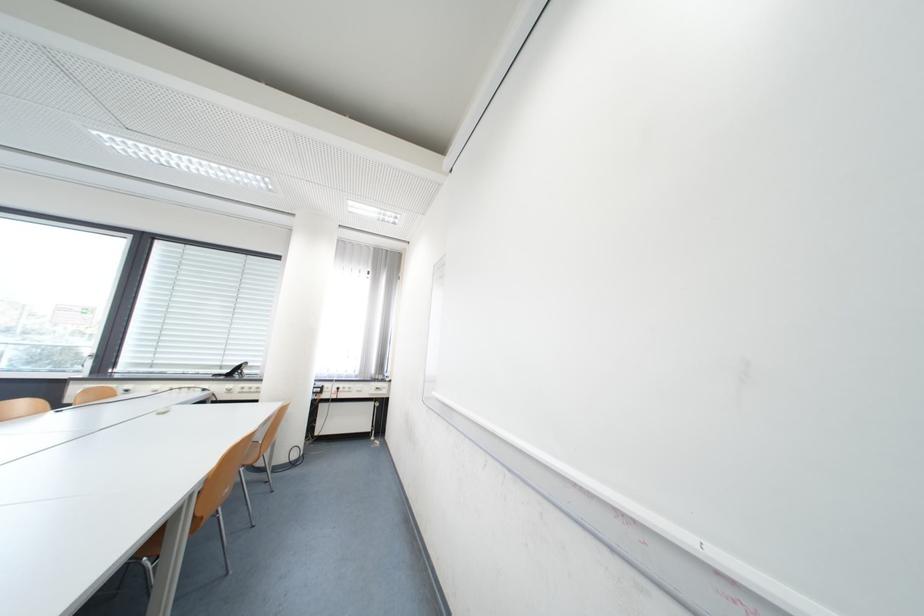
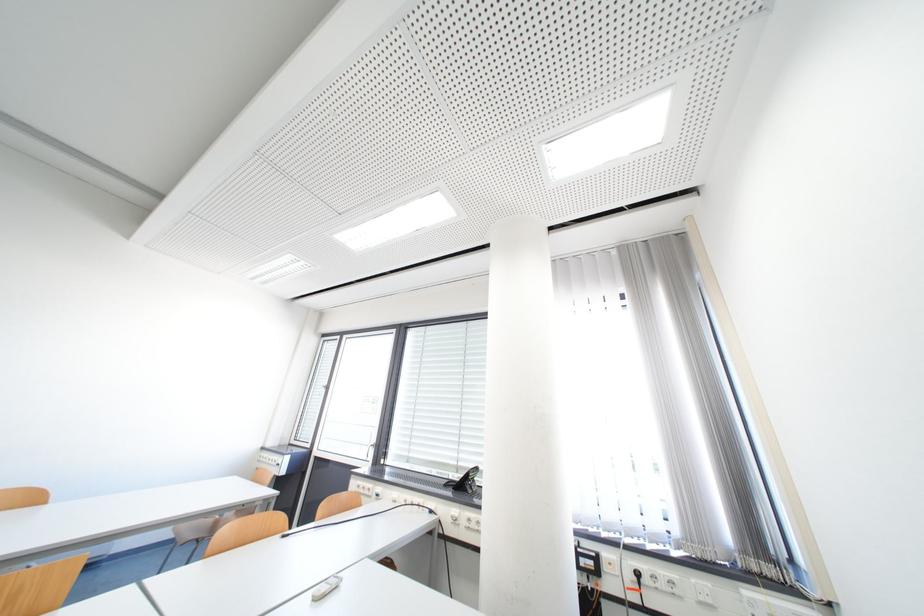
Where in the second image is the point corresponding to (348,390) from the first image?

(649, 576)